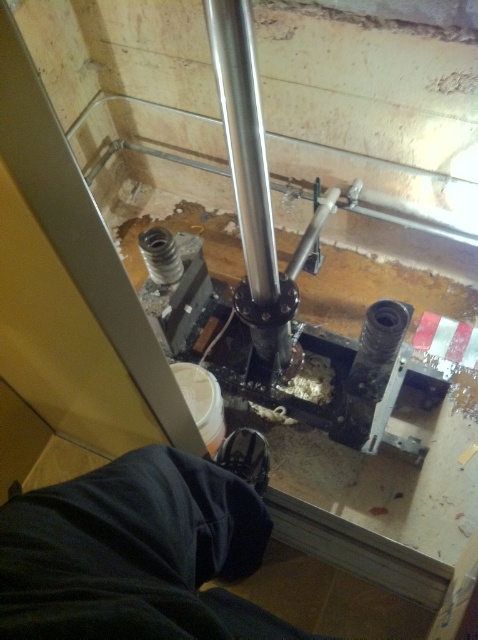
Question: Which point is closer to the camera?

Choices:
 (A) (94, 490)
 (B) (271, 326)

Answer: (A)

Question: Is dark blue fabric at lower left wider than polished metal pipe at center?

Choices:
 (A) yes
 (B) no

Answer: (A)

Question: Does dark blue fabric at lower left appear under polished metal pipe at center?

Choices:
 (A) no
 (B) yes

Answer: (B)

Question: Which point appears farthest from the camera in this image?

Choices:
 (A) (97, 474)
 (B) (249, 211)

Answer: (B)

Question: Can you confirm if dark blue fabric at lower left is thinner than polished metal pipe at center?

Choices:
 (A) yes
 (B) no

Answer: (B)